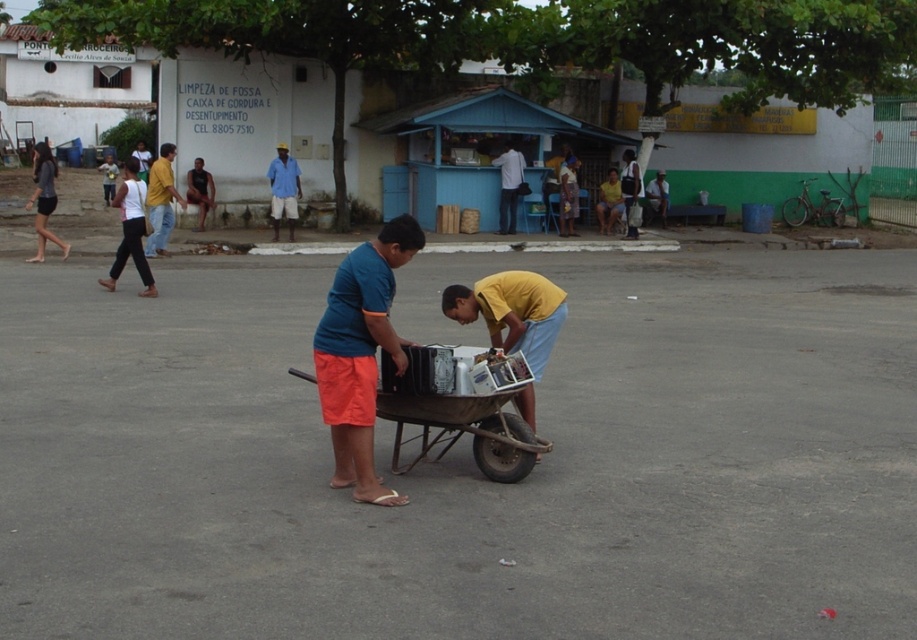
Question: Does matte black shorts at left appear under blue cotton shirt at center?

Choices:
 (A) yes
 (B) no

Answer: (B)

Question: Which object appears farthest from the camera in this image?

Choices:
 (A) yellow cotton shirt at center
 (B) brown wooden cart at center
 (C) blue matte shirt at center
 (D) white cotton shirt at upper center

Answer: (D)

Question: Among these objects, which one is farthest from the camera?

Choices:
 (A) white cotton shirt at upper center
 (B) matte black shorts at left

Answer: (A)

Question: Does blue matte shirt at center appear on the right side of brown wooden cart at center?

Choices:
 (A) yes
 (B) no

Answer: (B)

Question: Does blue matte shirt at center have a larger size compared to white cotton shirt at upper center?

Choices:
 (A) no
 (B) yes

Answer: (A)

Question: Which object is positioned closest to the yellow cotton shirt at center?

Choices:
 (A) white cotton shirt at upper center
 (B) blue cotton shirt at center

Answer: (B)